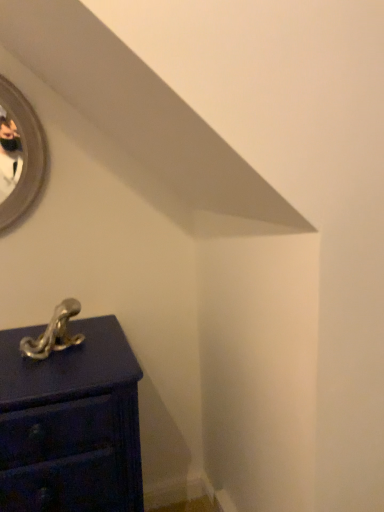
Locate an element on the screen. The image size is (384, 512). vacant space underneath polished silver hook at lower left (from a real-world perspective) is located at coordinates (53, 354).